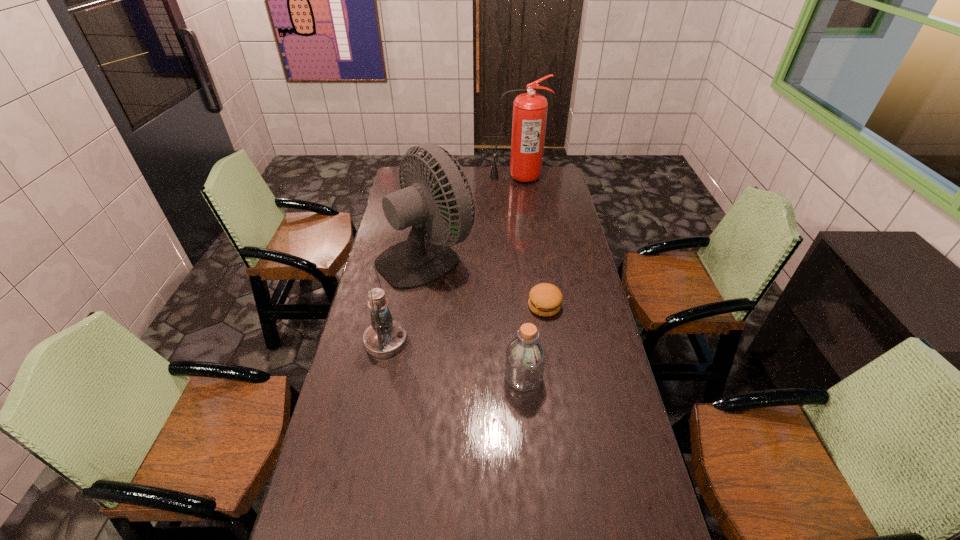
Identify the location of the farthest object. This screenshot has height=540, width=960. (529, 119).

Locate an element on the screen. The height and width of the screenshot is (540, 960). fan is located at coordinates (419, 260).

Identify the location of the second nearest object. This screenshot has height=540, width=960. (385, 337).

Where is `oil lamp`? The width and height of the screenshot is (960, 540). oil lamp is located at coordinates (385, 337).

Image resolution: width=960 pixels, height=540 pixels. I want to click on bottle, so click(x=525, y=359).

Locate an element on the screen. The height and width of the screenshot is (540, 960). the second shortest object is located at coordinates tap(525, 359).

The width and height of the screenshot is (960, 540). Identify the location of the shortest object. (545, 299).

In order to click on the third farthest object in this screenshot , I will do `click(545, 299)`.

Locate an element on the screen. vacant space situated 0.360m on the instruction side of the farthest object is located at coordinates (523, 225).

Find the location of a particular element. The height and width of the screenshot is (540, 960). free location located in front of the second farthest object to direct airflow is located at coordinates (532, 255).